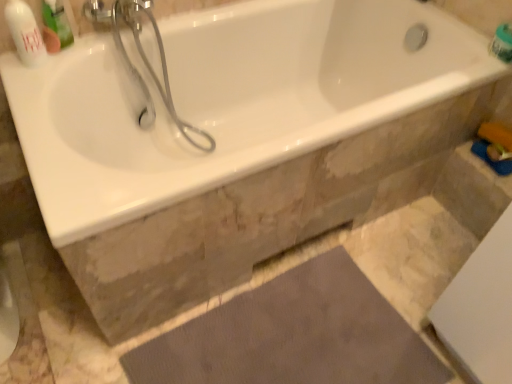
Locate an element on the screen. The width and height of the screenshot is (512, 384). unoccupied space behind green plastic container at upper right, which is the second toiletry in front-to-back order is located at coordinates (468, 30).